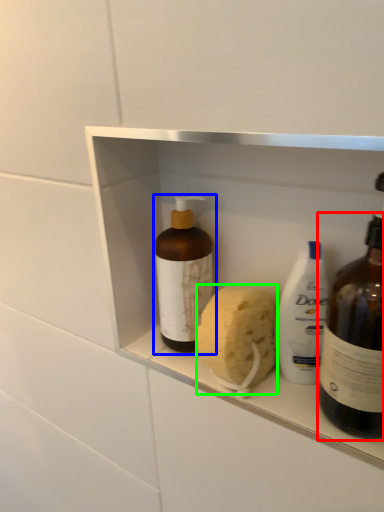
Question: Considering the real-world distances, which object is farthest from bottle (highlighted by a red box)? bottle (highlighted by a blue box) or soap (highlighted by a green box)?

Choices:
 (A) bottle
 (B) soap

Answer: (A)